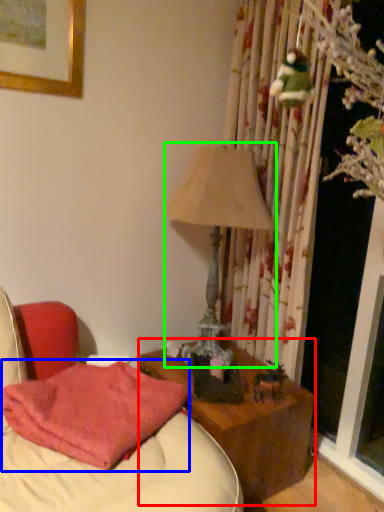
Question: Based on their relative distances, which object is farther from nightstand (highlighted by a red box)? Choose from pillow (highlighted by a blue box) and table lamp (highlighted by a green box).

Choices:
 (A) pillow
 (B) table lamp

Answer: (B)